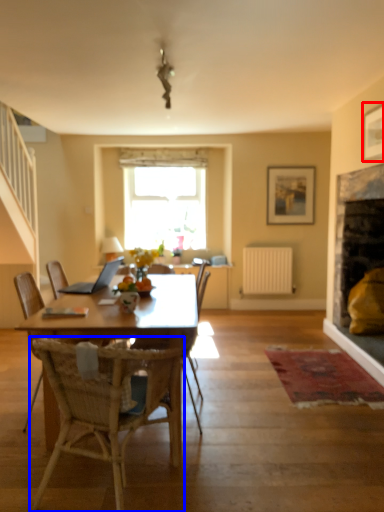
Question: Which point is closer to the camera, picture frame (highlighted by a red box) or chair (highlighted by a blue box)?

Choices:
 (A) picture frame
 (B) chair

Answer: (B)